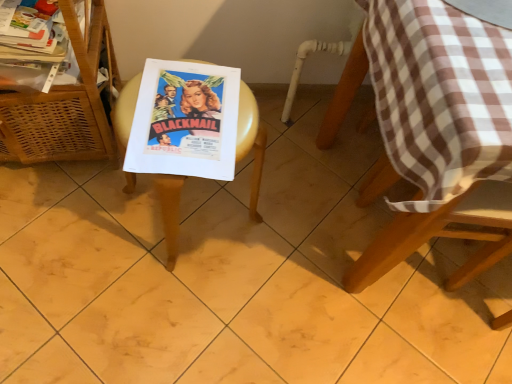
I want to click on free spot to the right of wooden picnic table at center, so click(280, 235).